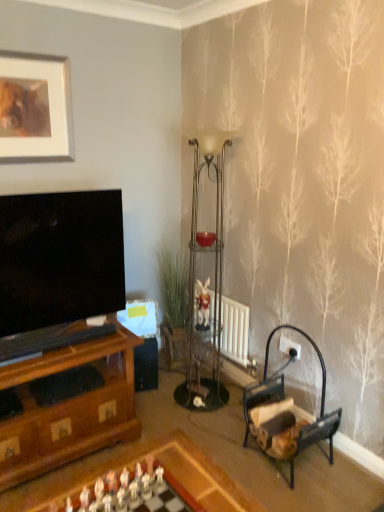
What do you see at coordinates (175, 345) in the screenshot?
I see `metallic glass side table at center` at bounding box center [175, 345].

What do you see at coordinates (130, 470) in the screenshot? I see `wooden chessboard at lower center` at bounding box center [130, 470].

What do you see at coordinates (205, 239) in the screenshot?
I see `matte glass candle holder at center` at bounding box center [205, 239].

This screenshot has height=512, width=384. What are the coordinates of `metallic glass shelf at center` in the screenshot? It's located at (203, 284).

Is wooden chessboard at lower center shorter than matte glass candle holder at center?

In fact, wooden chessboard at lower center may be taller than matte glass candle holder at center.

Would you consider wooden chessboard at lower center to be distant from matte glass candle holder at center?

Yes, wooden chessboard at lower center and matte glass candle holder at center are located far from each other.

Can you tell me how much wooden chessboard at lower center and matte glass candle holder at center differ in facing direction?

There is a 61.3-degree angle between the facing directions of wooden chessboard at lower center and matte glass candle holder at center.

Is wooden chessboard at lower center at the left side of matte glass candle holder at center?

Yes, wooden chessboard at lower center is to the left of matte glass candle holder at center.

Can we say wooden armchair at lower right lies outside wooden chess set at center?

Yes, wooden armchair at lower right is located beyond the bounds of wooden chess set at center.

From the image's perspective, does wooden armchair at lower right appear higher than wooden chess set at center?

Yes, from the image's perspective, wooden armchair at lower right is above wooden chess set at center.

Is wooden armchair at lower right far from wooden chess set at center?

They are positioned close to each other.

Is wooden chessboard at lower center not near metallic glass shelf at center?

wooden chessboard at lower center is positioned a significant distance from metallic glass shelf at center.

Could you tell me if wooden chessboard at lower center is turned towards metallic glass shelf at center?

No, wooden chessboard at lower center is not turned towards metallic glass shelf at center.

From the image's perspective, which is below, metallic glass side table at center or wooden armchair at lower right?

wooden armchair at lower right appears lower in the image.

From a real-world perspective, is metallic glass side table at center under wooden armchair at lower right?

Yes.

Find the location of a particular element. armchair above the metallic glass side table at center (from a real-world perspective) is located at coordinates (286, 413).

How far apart are metallic glass side table at center and wooden armchair at lower right?

metallic glass side table at center and wooden armchair at lower right are 34.32 inches apart from each other.

Is metallic glass shelf at center not close to matte silver picture frame at upper left?

metallic glass shelf at center is positioned a significant distance from matte silver picture frame at upper left.

Considering the relative sizes of metallic glass shelf at center and matte silver picture frame at upper left in the image provided, is metallic glass shelf at center smaller than matte silver picture frame at upper left?

No.

From a real-world perspective, is metallic glass shelf at center located higher than matte silver picture frame at upper left?

No, from a real-world perspective, metallic glass shelf at center is not above matte silver picture frame at upper left.

Is metallic glass shelf at center thinner than matte silver picture frame at upper left?

In fact, metallic glass shelf at center might be wider than matte silver picture frame at upper left.

Could you tell me if wooden chessboard at lower center is turned towards wooden chess set at center?

No, wooden chessboard at lower center is not oriented towards wooden chess set at center.

In terms of width, does wooden chessboard at lower center look wider or thinner when compared to wooden chess set at center?

Clearly, wooden chessboard at lower center has more width compared to wooden chess set at center.

From a real-world perspective, which object rests below the other?

wooden chessboard at lower center is physically lower.

Considering the relative sizes of wooden chessboard at lower center and wooden chess set at center in the image provided, is wooden chessboard at lower center taller than wooden chess set at center?

Yes, wooden chessboard at lower center is taller than wooden chess set at center.

Based on their positions, is wooden chess set at center located to the left or right of matte glass candle holder at center?

Clearly, wooden chess set at center is on the left of matte glass candle holder at center in the image.

Looking at this image, from a real-world perspective, is wooden chess set at center located beneath matte glass candle holder at center?

Indeed, from a real-world perspective, wooden chess set at center is positioned beneath matte glass candle holder at center.

Considering the sizes of wooden chess set at center and matte glass candle holder at center in the image, is wooden chess set at center bigger or smaller than matte glass candle holder at center?

Considering their sizes, wooden chess set at center takes up more space than matte glass candle holder at center.

Consider the image. In terms of width, does wooden chess set at center look wider or thinner when compared to matte glass candle holder at center?

Clearly, wooden chess set at center has more width compared to matte glass candle holder at center.

Locate an element on the screen. candle holder lying behind the wooden chessboard at lower center is located at coordinates (205, 239).

Find the location of `armchair below the wooden chess set at center (from a real-world perspective)`. armchair below the wooden chess set at center (from a real-world perspective) is located at coordinates (286, 413).

Which object lies nearer to the anchor point wooden chess set at center, wooden chessboard at lower center or matte glass candle holder at center?

The object closer to wooden chess set at center is wooden chessboard at lower center.

Estimate the real-world distances between objects in this image. Which object is closer to matte silver picture frame at upper left, wooden armchair at lower right or metallic glass side table at center?

The object closer to matte silver picture frame at upper left is metallic glass side table at center.

Considering their positions, is matte silver picture frame at upper left positioned further to wooden armchair at lower right than metallic glass shelf at center?

matte silver picture frame at upper left lies further to wooden armchair at lower right than the other object.

Looking at the image, which one is located closer to metallic glass shelf at center, matte silver picture frame at upper left or wooden chess set at center?

matte silver picture frame at upper left is positioned closer to the anchor metallic glass shelf at center.

Based on the photo, from the image, which object appears to be farther from wooden chess set at center, matte glass candle holder at center or matte silver picture frame at upper left?

Among the two, matte silver picture frame at upper left is located further to wooden chess set at center.

From the picture: From the image, which object appears to be farther from matte glass candle holder at center, wooden chessboard at lower center or wooden chess set at center?

Among the two, wooden chess set at center is located further to matte glass candle holder at center.

Based on their spatial positions, is wooden armchair at lower right or matte glass candle holder at center further from matte silver picture frame at upper left?

Among the two, wooden armchair at lower right is located further to matte silver picture frame at upper left.

From the image, which object appears to be nearer to wooden armchair at lower right, matte silver picture frame at upper left or metallic glass side table at center?

metallic glass side table at center is positioned closer to the anchor wooden armchair at lower right.

You are a GUI agent. You are given a task and a screenshot of the screen. Output one action in this format:
    pyautogui.click(x=<x>, y=<y>)
    Task: Click on the lamp between matte silver picture frame at upper left and wooden chess set at center vertically
    
    Given the screenshot: What is the action you would take?
    click(203, 284)

The image size is (384, 512). In order to click on lamp between matte glass candle holder at center and wooden armchair at lower right in the vertical direction in this screenshot , I will do `click(203, 284)`.

Where is `candle holder between matte silver picture frame at upper left and wooden chessboard at lower center from top to bottom`? The width and height of the screenshot is (384, 512). candle holder between matte silver picture frame at upper left and wooden chessboard at lower center from top to bottom is located at coordinates (205, 239).

You are a GUI agent. You are given a task and a screenshot of the screen. Output one action in this format:
    pyautogui.click(x=<x>, y=<y>)
    Task: Click on the armchair between wooden chess set at center and metallic glass shelf at center in the front-back direction
    
    Given the screenshot: What is the action you would take?
    pyautogui.click(x=286, y=413)